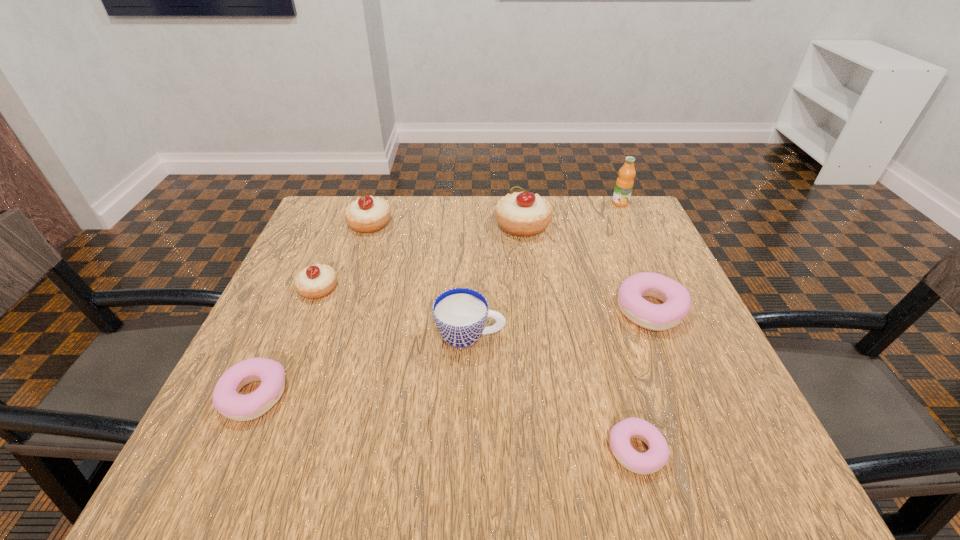
At what (x,y) coordinates should I click in order to perform the action: click on vacant region at the right edge. Please return your answer as a coordinate pair (x, y). Looking at the image, I should click on (666, 256).

This screenshot has width=960, height=540. I want to click on free spot at the far right corner of the desktop, so click(x=615, y=227).

You are a GUI agent. You are given a task and a screenshot of the screen. Output one action in this format:
    pyautogui.click(x=<x>, y=<y>)
    Task: Click on the vacant space at the near right corner of the desktop
    Image resolution: width=960 pixels, height=540 pixels.
    Given the screenshot: What is the action you would take?
    pyautogui.click(x=722, y=449)

The width and height of the screenshot is (960, 540). In order to click on vacant space that is in between the second smallest pink pastry and the second smallest beige pastry in this screenshot , I will do `click(312, 309)`.

I want to click on free space between the cup and the shortest object, so click(553, 393).

You are a GUI agent. You are given a task and a screenshot of the screen. Output one action in this format:
    pyautogui.click(x=<x>, y=<y>)
    Task: Click on the vacant space in between the shortest pastry and the cup
    The image size is (960, 540).
    Given the screenshot: What is the action you would take?
    pyautogui.click(x=553, y=393)

Image resolution: width=960 pixels, height=540 pixels. What are the coordinates of `free spot between the tallest pastry and the nearest beige pastry` in the screenshot? It's located at (420, 256).

Image resolution: width=960 pixels, height=540 pixels. Identify the location of free space between the second biggest beige pastry and the second smallest pink pastry. (312, 309).

In order to click on free space between the third shortest pastry and the second shortest pastry in this screenshot , I will do `click(452, 352)`.

This screenshot has width=960, height=540. What are the coordinates of `free space between the cup and the fourth shortest pastry` in the screenshot? It's located at (395, 312).